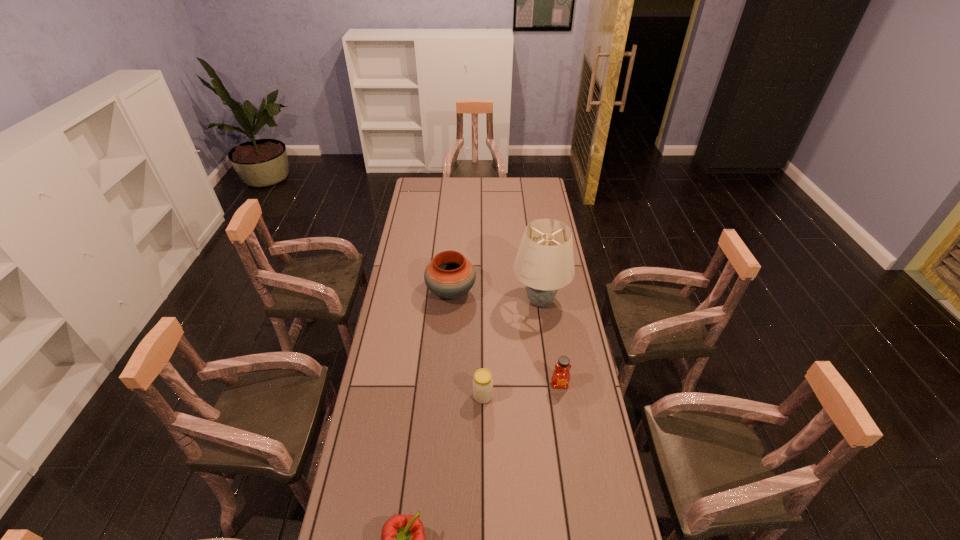
The height and width of the screenshot is (540, 960). I want to click on free space at the left edge of the desktop, so click(x=403, y=363).

Locate an element on the screen. This screenshot has width=960, height=540. free space at the right edge is located at coordinates (550, 375).

The width and height of the screenshot is (960, 540). I want to click on blank region between the pottery and the honey, so click(x=505, y=339).

Locate an element on the screen. Image resolution: width=960 pixels, height=540 pixels. empty location between the honey and the jar is located at coordinates (521, 390).

Find the location of `empty space between the honey and the pottery`. empty space between the honey and the pottery is located at coordinates point(505,339).

You are a GUI agent. You are given a task and a screenshot of the screen. Output one action in this format:
    pyautogui.click(x=<x>, y=<y>)
    Task: Click on the vacant space that is in between the honey and the jar
    
    Given the screenshot: What is the action you would take?
    pyautogui.click(x=521, y=390)

Find the location of `vacant area between the jar and the tallest object`. vacant area between the jar and the tallest object is located at coordinates (512, 349).

This screenshot has height=540, width=960. Find the location of `vacant area between the lampshade and the jar`. vacant area between the lampshade and the jar is located at coordinates (512, 349).

Point out which object is positioned as the fourth nearest to the pottery. Please provide its 2D coordinates. Your answer should be formatted as a tuple, i.e. [(x, y)], where the tuple contains the x and y coordinates of a point satisfying the conditions above.

[(403, 539)]

Select which object appears as the fourth closest to the tallest object. Please provide its 2D coordinates. Your answer should be formatted as a tuple, i.e. [(x, y)], where the tuple contains the x and y coordinates of a point satisfying the conditions above.

[(403, 539)]